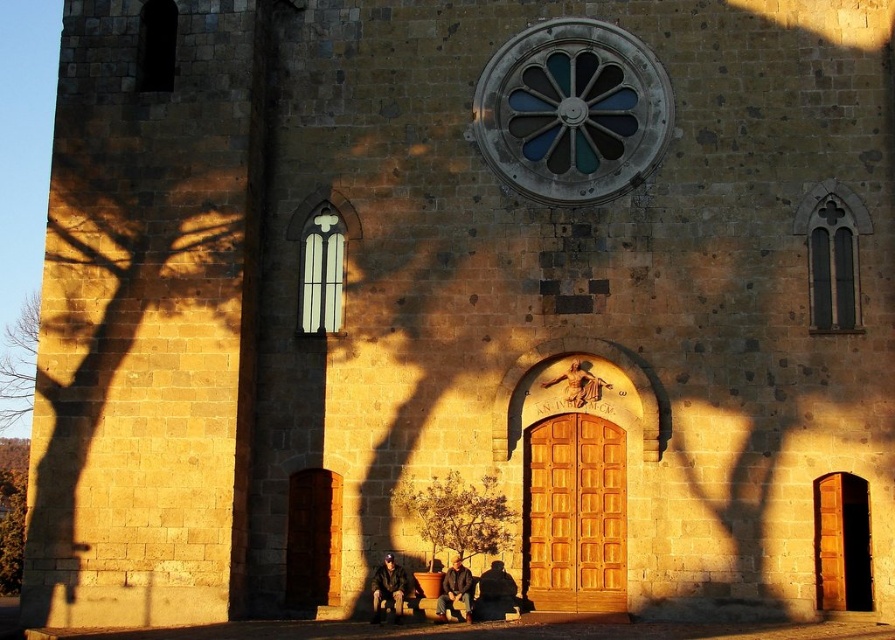
You are standing in front of the church and notice a leather jacket at lower center. If you want to place a small statue exactly where the leather jacket is currently located, what coordinates should you aim for?

The coordinates for the leather jacket at lower center are at point [388,588], so you should aim for those coordinates to place the statue there.

You are standing in front of the historic stone church and want to determine the relative positions of two points marked on the facade. Which point, point (x=465, y=596) or point (x=574, y=369), is closer to you?

Point (x=465, y=596) is closer to the viewer than point (x=574, y=369).